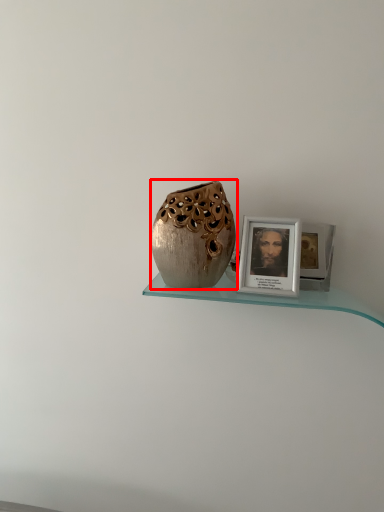
Question: From the image's perspective, what is the correct spatial positioning of vase (annotated by the red box) in reference to picture frame?

Choices:
 (A) above
 (B) below

Answer: (A)